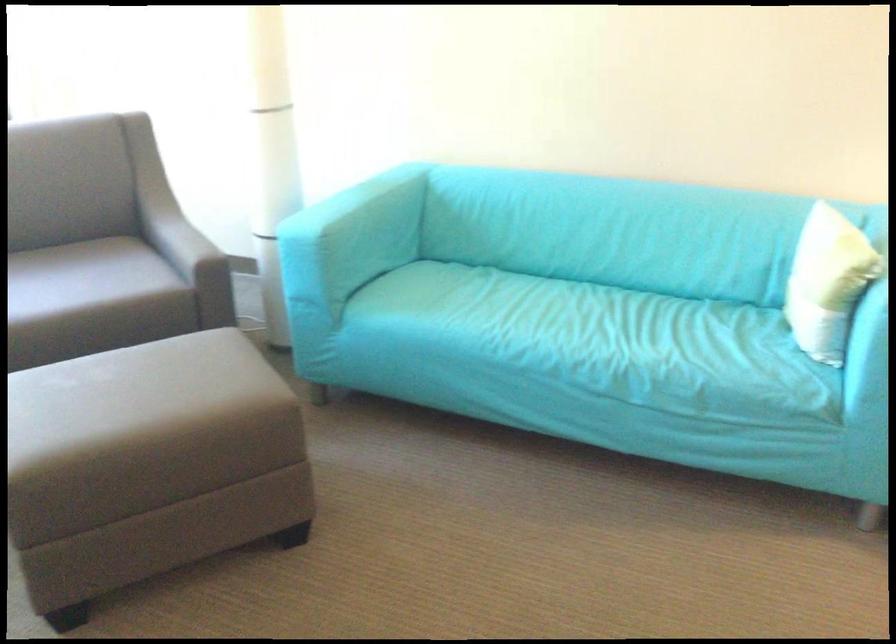
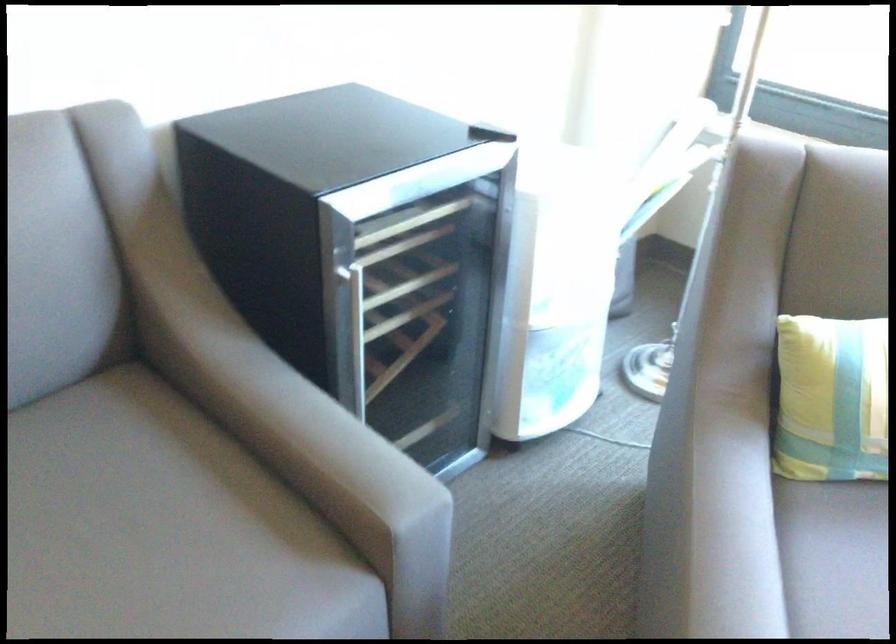
Based on the continuous images, in which direction is the camera rotating?

The camera rotated toward left-down.